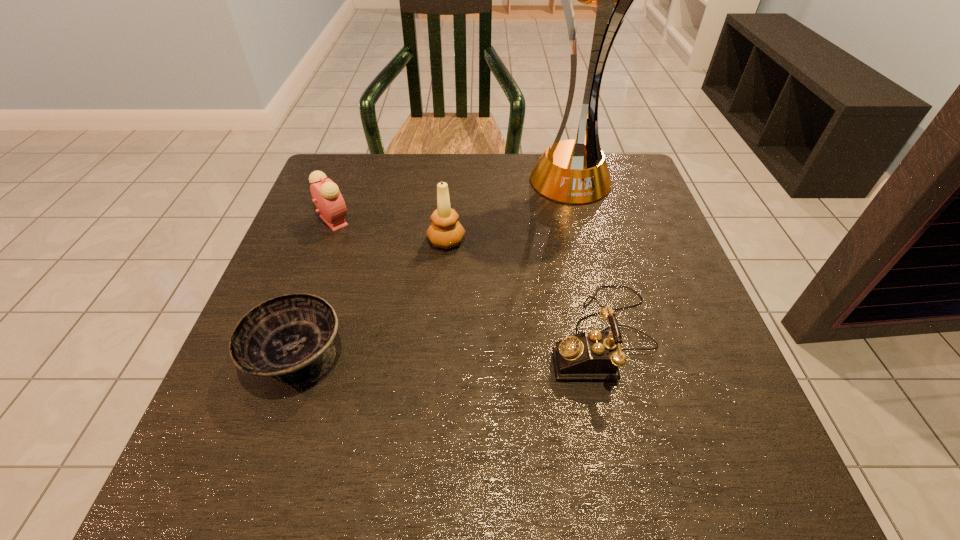
Where is `vacant space located 0.260m on the dial of the telephone`? This screenshot has width=960, height=540. vacant space located 0.260m on the dial of the telephone is located at coordinates [x=406, y=335].

Identify the location of vacant space located on the dial of the telephone. The width and height of the screenshot is (960, 540). (401, 335).

Find the location of a particular element. The width and height of the screenshot is (960, 540). free location located on the dial of the telephone is located at coordinates pyautogui.click(x=384, y=335).

Image resolution: width=960 pixels, height=540 pixels. I want to click on free space located 0.340m on the right of the shortest object, so click(x=542, y=357).

Where is `object that is positioned at the far edge`? The width and height of the screenshot is (960, 540). object that is positioned at the far edge is located at coordinates (575, 171).

Where is `alarm clock that is at the left edge`? This screenshot has height=540, width=960. alarm clock that is at the left edge is located at coordinates (325, 193).

Find the location of a particular element. The width and height of the screenshot is (960, 540). bowl that is positioned at the left edge is located at coordinates (289, 338).

Where is `trophy at the right edge`? The height and width of the screenshot is (540, 960). trophy at the right edge is located at coordinates (575, 171).

The image size is (960, 540). Find the location of `telephone that is at the right edge`. telephone that is at the right edge is located at coordinates (591, 355).

You are a GUI agent. You are given a task and a screenshot of the screen. Output one action in this format:
    pyautogui.click(x=<x>, y=<y>)
    Task: Click on the object situated at the far right corner
    This screenshot has height=540, width=960.
    Given the screenshot: What is the action you would take?
    pyautogui.click(x=575, y=171)